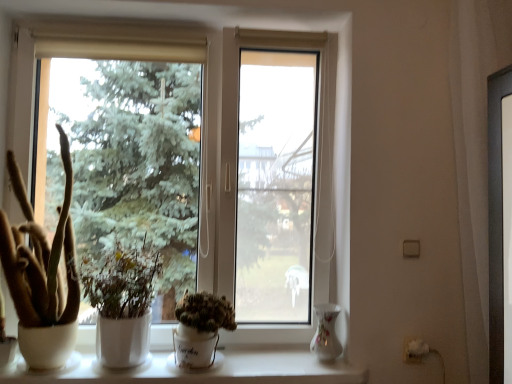
At what (x,y) coordinates should I click in order to perform the action: click on free space above white ceramic at lower center (from a real-world perspective). Please return your answer as a coordinate pair (x, y). The image size is (512, 384). Looking at the image, I should click on (178, 362).